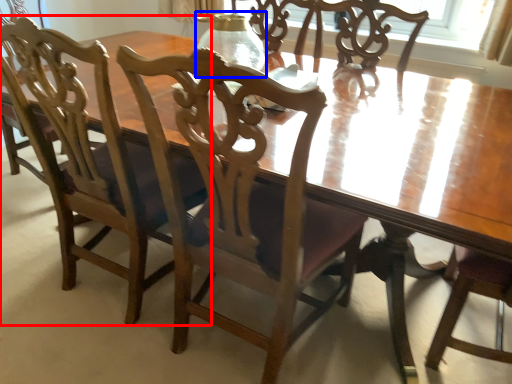
Question: Which object appears farthest to the camera in this image, chair (highlighted by a red box) or glass vase (highlighted by a blue box)?

Choices:
 (A) chair
 (B) glass vase

Answer: (B)